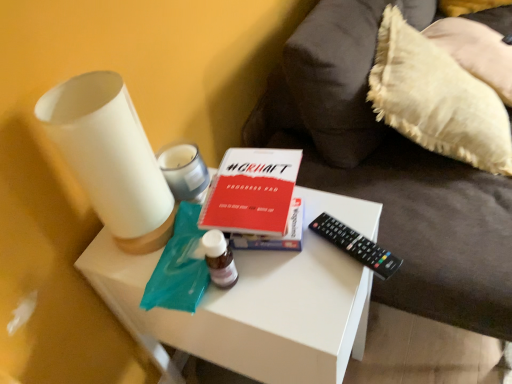
Question: From a real-world perspective, does red matte progress pad at center sit lower than black plastic remote at right?

Choices:
 (A) no
 (B) yes

Answer: (A)

Question: Considering the relative sizes of red matte progress pad at center and black plastic remote at right in the image provided, is red matte progress pad at center thinner than black plastic remote at right?

Choices:
 (A) no
 (B) yes

Answer: (A)

Question: From the image's perspective, is red matte progress pad at center over black plastic remote at right?

Choices:
 (A) yes
 (B) no

Answer: (A)

Question: Is red matte progress pad at center wider than black plastic remote at right?

Choices:
 (A) no
 (B) yes

Answer: (B)

Question: Does red matte progress pad at center come behind black plastic remote at right?

Choices:
 (A) no
 (B) yes

Answer: (A)

Question: Can black plastic remote at right be found inside red matte progress pad at center?

Choices:
 (A) yes
 (B) no

Answer: (B)

Question: Is white matte table at center at the left side of black plastic remote at right?

Choices:
 (A) yes
 (B) no

Answer: (A)

Question: Does white matte table at center have a smaller size compared to black plastic remote at right?

Choices:
 (A) no
 (B) yes

Answer: (A)

Question: Is white matte table at center to the right of black plastic remote at right from the viewer's perspective?

Choices:
 (A) no
 (B) yes

Answer: (A)

Question: Is the surface of white matte table at center in direct contact with black plastic remote at right?

Choices:
 (A) no
 (B) yes

Answer: (A)

Question: Considering the relative sizes of white matte table at center and black plastic remote at right in the image provided, is white matte table at center taller than black plastic remote at right?

Choices:
 (A) yes
 (B) no

Answer: (A)

Question: Is white matte table at center outside of black plastic remote at right?

Choices:
 (A) yes
 (B) no

Answer: (A)

Question: Is white matte vase at left, the second candle holder positioned from the back, closer to camera compared to white fluffy pillow at right?

Choices:
 (A) yes
 (B) no

Answer: (A)